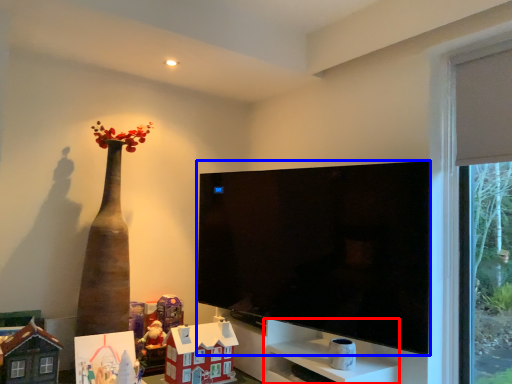
Question: Which object appears closest to the camera in this image, cabinet (highlighted by a red box) or television (highlighted by a blue box)?

Choices:
 (A) cabinet
 (B) television

Answer: (B)